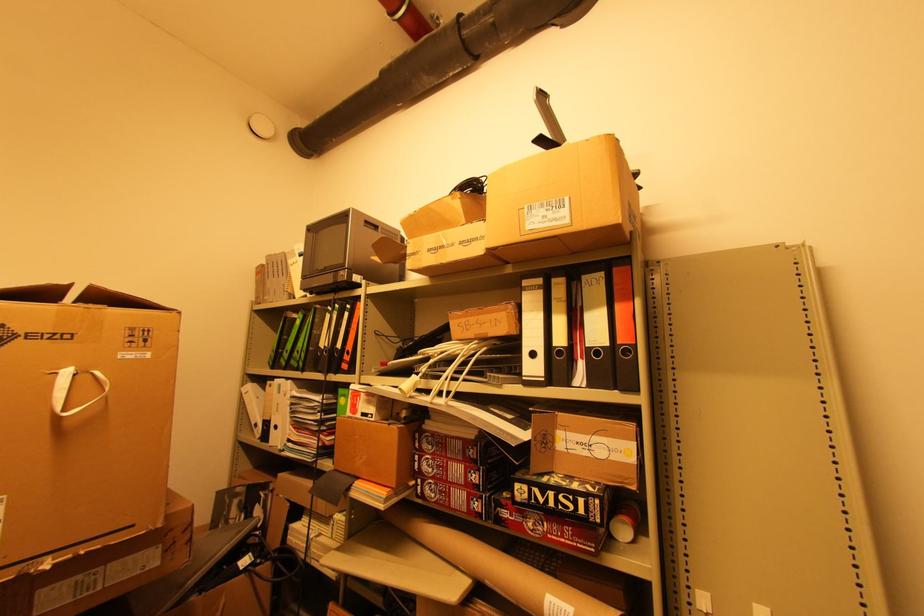
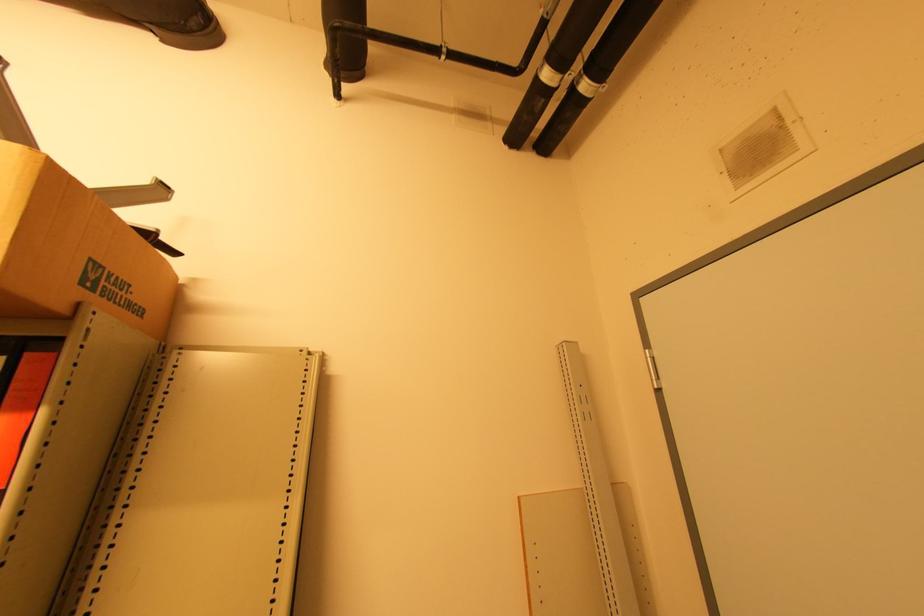
Question: Based on the continuous images, in which direction is the camera rotating? Reply with the corresponding letter.

Choices:
 (A) Left
 (B) Right
 (C) Up
 (D) Down

Answer: (B)